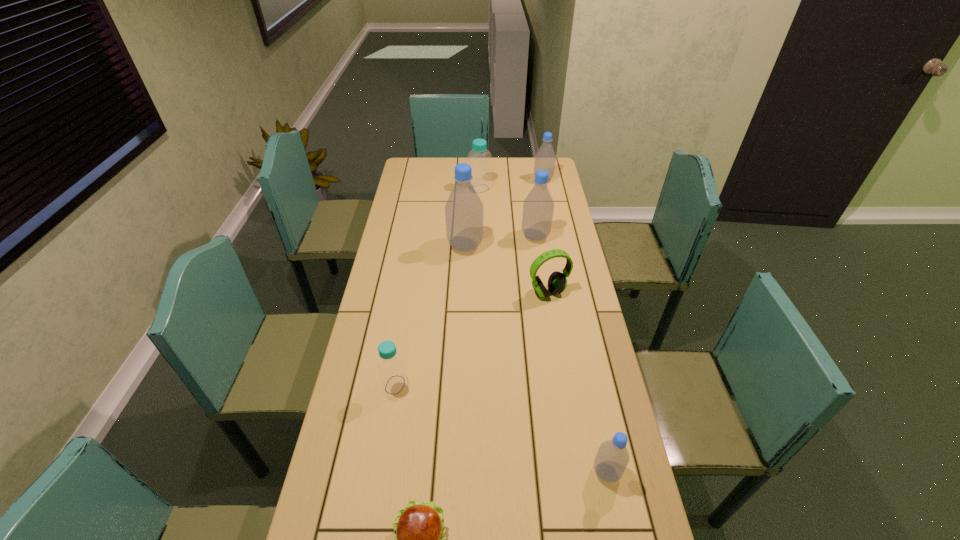
What are the coordinates of `free space between the farthest gray bottle and the second nearest object` in the screenshot? It's located at (575, 326).

Where is `blank region between the farther blue bottle and the leftmost bottle`? The height and width of the screenshot is (540, 960). blank region between the farther blue bottle and the leftmost bottle is located at coordinates (437, 287).

Identify the location of free space between the second tallest object and the right blue bottle. This screenshot has width=960, height=540. (508, 213).

Locate an element on the screen. This screenshot has width=960, height=540. free spot between the nearest gray bottle and the leftmost gray bottle is located at coordinates [x=536, y=359].

Locate an element on the screen. This screenshot has height=540, width=960. unoccupied position between the second smallest gray bottle and the leftmost object is located at coordinates (469, 282).

This screenshot has width=960, height=540. I want to click on vacant point located between the farther blue bottle and the nearest bottle, so click(543, 330).

Select which object is the sixth closest to the tallest bottle. Please provide its 2D coordinates. Your answer should be formatted as a tuple, i.e. [(x, y)], where the tuple contains the x and y coordinates of a point satisfying the conditions above.

[(612, 458)]

Where is `object that stands as the fourth closest to the headset`? The width and height of the screenshot is (960, 540). object that stands as the fourth closest to the headset is located at coordinates (612, 458).

The height and width of the screenshot is (540, 960). Find the location of `the closest bottle to the left blue bottle`. the closest bottle to the left blue bottle is located at coordinates (612, 458).

Locate which bottle ranks fifth in proximity to the biggest gray bottle. Please provide its 2D coordinates. Your answer should be formatted as a tuple, i.e. [(x, y)], where the tuple contains the x and y coordinates of a point satisfying the conditions above.

[(612, 458)]